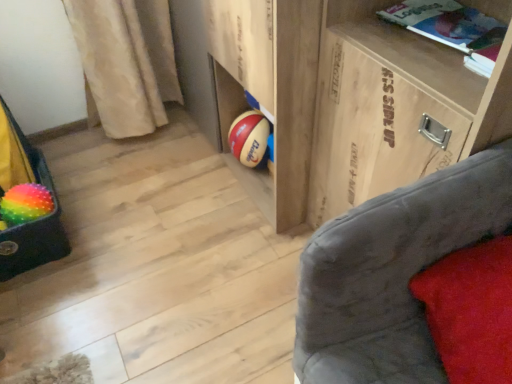
Question: From a real-world perspective, is white paper book at upper right located beneath wooden at center?

Choices:
 (A) yes
 (B) no

Answer: (B)

Question: Is white paper book at upper right located outside wooden at center?

Choices:
 (A) no
 (B) yes

Answer: (B)

Question: Is white paper book at upper right wider than wooden at center?

Choices:
 (A) yes
 (B) no

Answer: (B)

Question: Is white paper book at upper right in front of wooden at center?

Choices:
 (A) no
 (B) yes

Answer: (B)

Question: Is white paper book at upper right thinner than wooden at center?

Choices:
 (A) no
 (B) yes

Answer: (B)

Question: Is white paper book at upper right positioned with its back to wooden at center?

Choices:
 (A) no
 (B) yes

Answer: (A)

Question: Would you say rainbow fuzzy bean bag chair at left is outside wooden at center?

Choices:
 (A) no
 (B) yes

Answer: (B)

Question: Is rainbow fuzzy bean bag chair at left in front of wooden at center?

Choices:
 (A) no
 (B) yes

Answer: (A)

Question: Is wooden at center a part of rainbow fuzzy bean bag chair at left?

Choices:
 (A) no
 (B) yes

Answer: (A)

Question: Is rainbow fuzzy bean bag chair at left oriented away from wooden at center?

Choices:
 (A) yes
 (B) no

Answer: (B)

Question: Is rainbow fuzzy bean bag chair at left positioned far away from wooden at center?

Choices:
 (A) no
 (B) yes

Answer: (A)

Question: Could you tell me if rainbow fuzzy bean bag chair at left is turned towards wooden at center?

Choices:
 (A) no
 (B) yes

Answer: (B)

Question: From a real-world perspective, is rainbow rubber beach ball at lower left located higher than red velvet pillow at lower right?

Choices:
 (A) yes
 (B) no

Answer: (B)